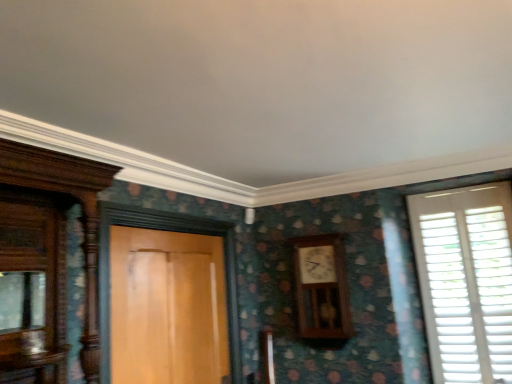
Question: Is wooden door at center closer to the viewer compared to wooden clock at center-right?

Choices:
 (A) yes
 (B) no

Answer: (A)

Question: Is wooden door at center oriented towards wooden clock at center-right?

Choices:
 (A) no
 (B) yes

Answer: (A)

Question: Considering the relative sizes of wooden door at center and wooden clock at center-right in the image provided, is wooden door at center shorter than wooden clock at center-right?

Choices:
 (A) yes
 (B) no

Answer: (B)

Question: Is wooden door at center surrounding wooden clock at center-right?

Choices:
 (A) no
 (B) yes

Answer: (A)

Question: Can you confirm if wooden door at center is taller than wooden clock at center-right?

Choices:
 (A) no
 (B) yes

Answer: (B)

Question: Is wooden door at center to the left of wooden clock at center-right from the viewer's perspective?

Choices:
 (A) no
 (B) yes

Answer: (B)

Question: Does wooden clock at center-right appear on the right side of white wooden shutters at right?

Choices:
 (A) no
 (B) yes

Answer: (A)

Question: Does wooden clock at center-right have a lesser width compared to white wooden shutters at right?

Choices:
 (A) yes
 (B) no

Answer: (B)

Question: Does wooden clock at center-right have a greater width compared to white wooden shutters at right?

Choices:
 (A) yes
 (B) no

Answer: (A)

Question: From the image's perspective, is wooden clock at center-right located above white wooden shutters at right?

Choices:
 (A) yes
 (B) no

Answer: (B)

Question: Is wooden clock at center-right oriented away from white wooden shutters at right?

Choices:
 (A) yes
 (B) no

Answer: (B)

Question: From a real-world perspective, does wooden clock at center-right sit lower than white wooden shutters at right?

Choices:
 (A) no
 (B) yes

Answer: (A)

Question: Is wooden door at center positioned behind white wooden shutters at right?

Choices:
 (A) yes
 (B) no

Answer: (B)